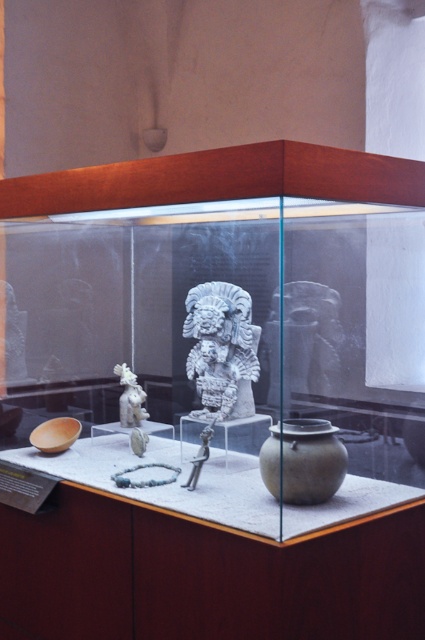
In the scene shown: You are a museum visitor observing the display case. The white stone carving at center and the metallic figure at center are both on pedestals. Which object is taller?

The white stone carving at center is taller than the metallic figure at center.